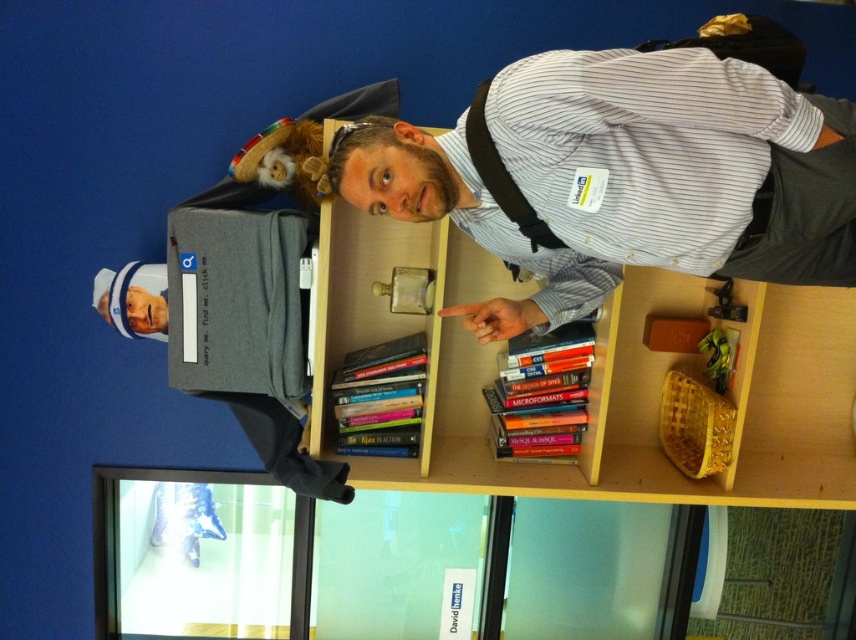
Can you confirm if striped cotton shirt at center is smaller than wooden bookcase at center?

Correct, striped cotton shirt at center occupies less space than wooden bookcase at center.

Is striped cotton shirt at center below wooden bookcase at center?

Incorrect, striped cotton shirt at center is not positioned below wooden bookcase at center.

Does point (788, 179) come behind point (629, 429)?

No, it is not.

Where is `striped cotton shirt at center`? The image size is (856, 640). striped cotton shirt at center is located at coordinates (626, 177).